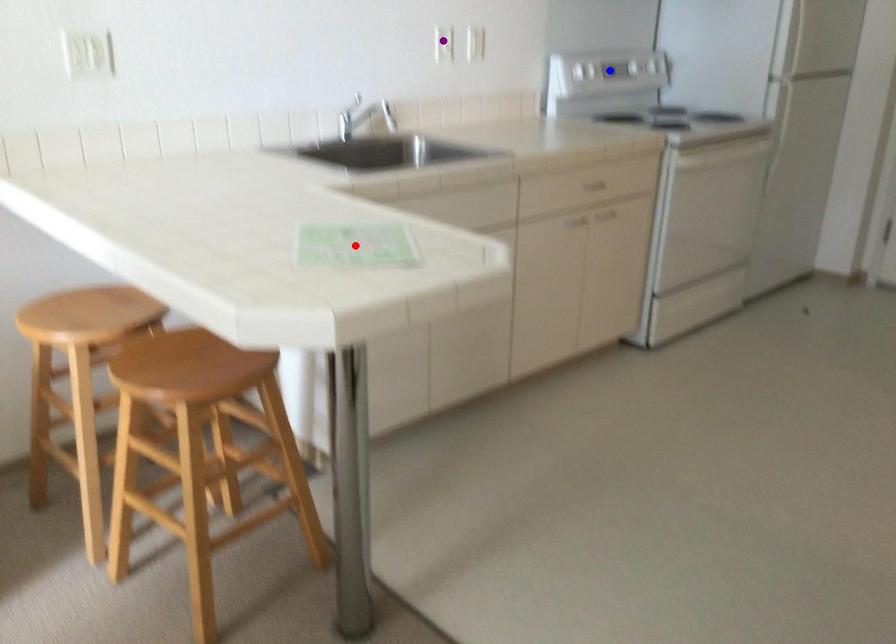
Order these from nearest to farthest:
- red point
- blue point
- purple point

1. red point
2. purple point
3. blue point